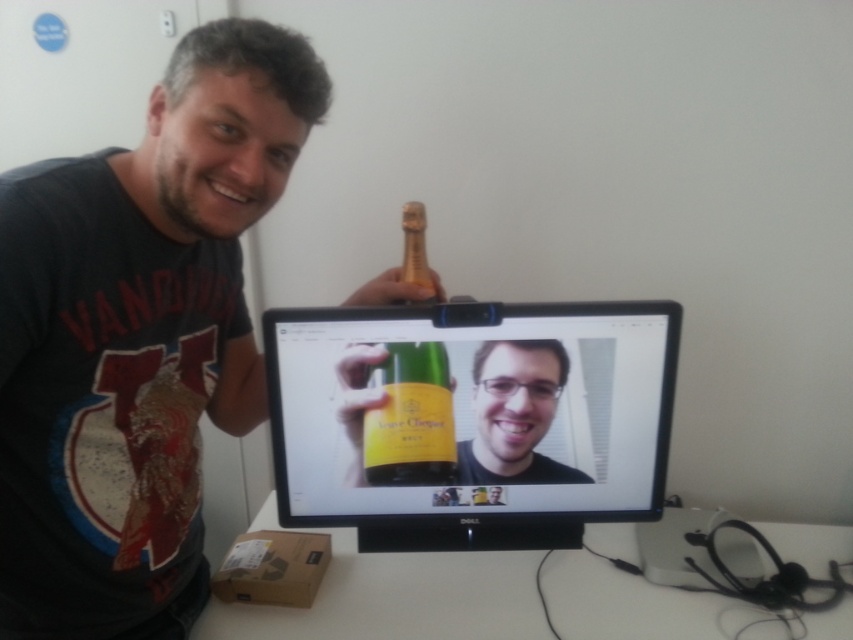
You are standing at a distance and want to reach the point marked at coordinates point (850, 609). If you take a step forward of 0.5 meters, will you be closer than 1 meter to that point?

The point marked at coordinates point (850, 609) is initially 1.16 meters away from you. After stepping forward 0.5 meters, your new distance would be 0.66 meters, which is less than 1 meter. Therefore, you will be closer than 1 meter to that point.